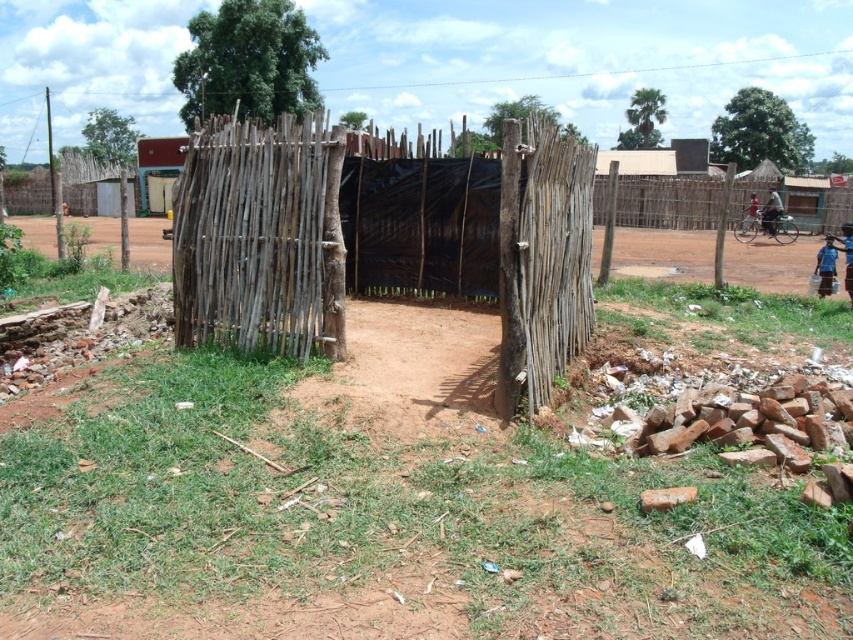
Looking at this image, you are standing in the rural scene and want to place a small potted plant between the natural wood fence at center and the blue fabric child at lower right. Based on their positions, where should the potted plant be placed relative to the blue fabric child?

The natural wood fence at center is located above the blue fabric child at lower right, so the potted plant should be placed below the natural wood fence at center and above the blue fabric child at lower right to position it between them.

Based on the photo, you are a delivery person who needs to place a package between the natural wood fence at center and the blue fabric child at lower right. The package requires a space of 8 meters. Can you fit it between them?

The distance between the natural wood fence at center and the blue fabric child at lower right is 7.50 meters, which is less than the required 8 meters. Therefore, the package cannot be placed between them.